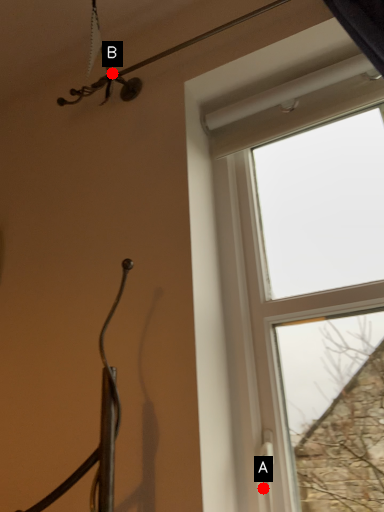
Question: Two points are circled on the image, labeled by A and B beside each circle. Which point is farther from the camera taking this photo?

Choices:
 (A) A is further
 (B) B is further

Answer: (B)